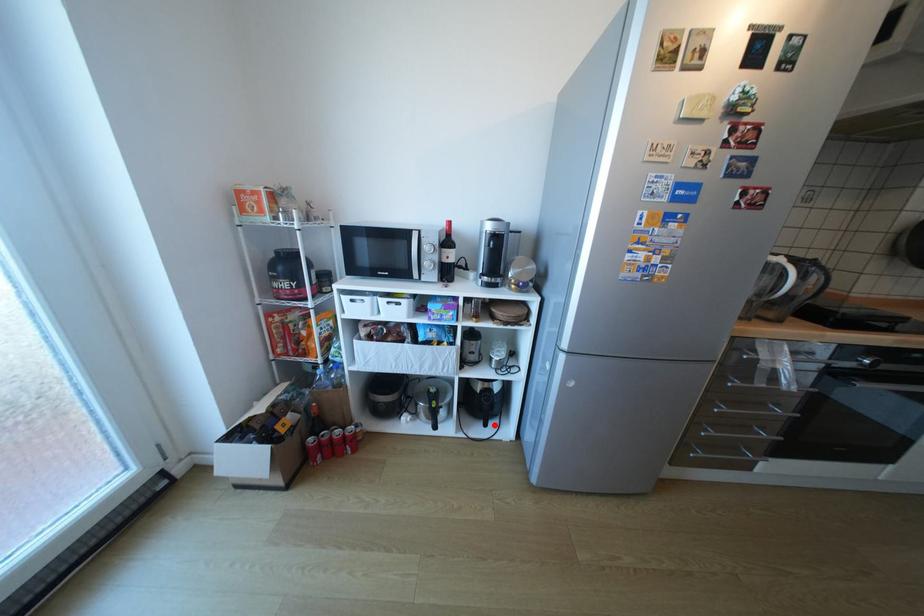
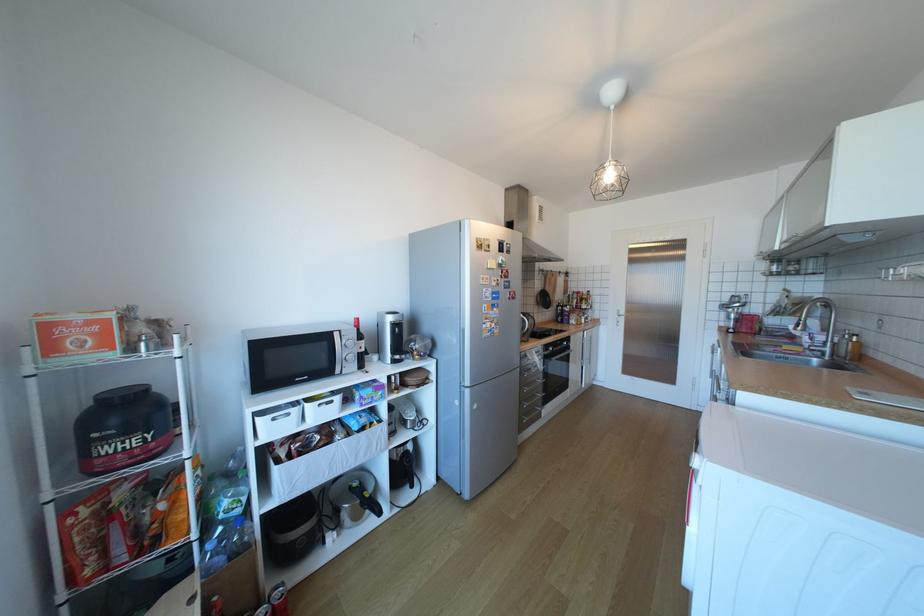
Question: I am providing you with two images of the same scene from different viewpoints. Given a red point in image1, look at the same physical point in image2. Is it:

Choices:
 (A) Closer to the viewpoint
 (B) Farther from the viewpoint

Answer: (A)